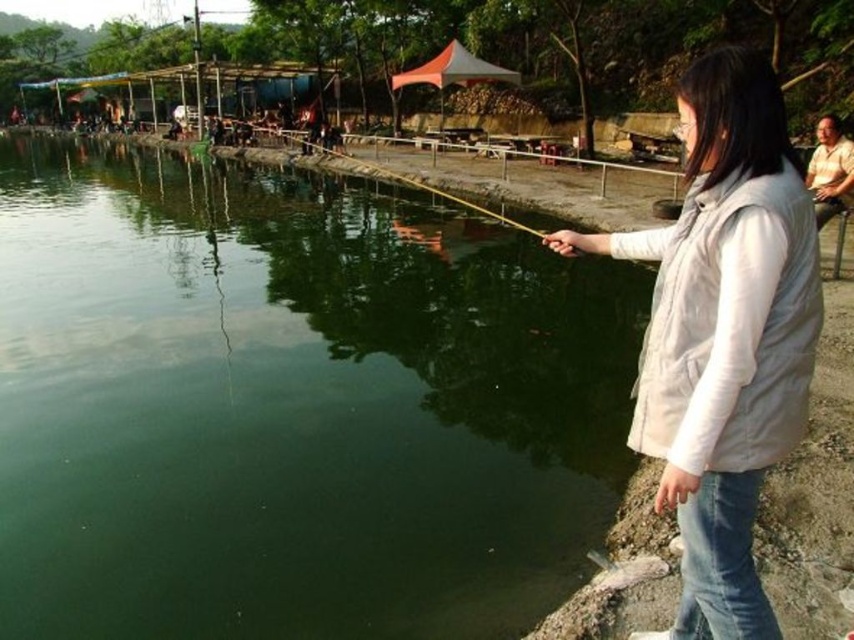
You are a photographer trying to capture the scene of the woman fishing. You want to position yourself so that the green smooth water at center and the white matte vest at right are both visible in your shot. Based on their positions, which object should appear on the left side of the photo?

The green smooth water at center is to the left of white matte vest at right, so in the photo, the green smooth water at center should appear on the left side.